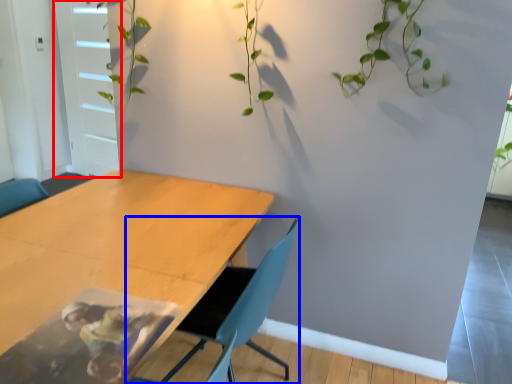
Question: Which object is closer to the camera taking this photo, glass door (highlighted by a red box) or chair (highlighted by a blue box)?

Choices:
 (A) glass door
 (B) chair

Answer: (B)